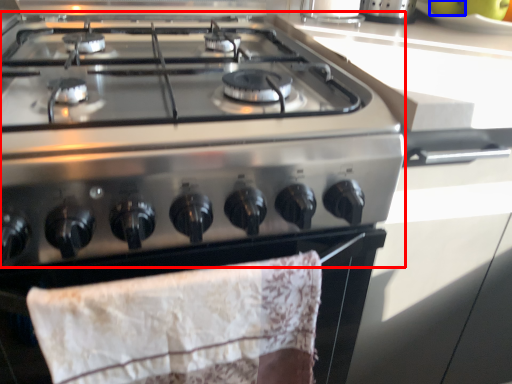
Question: Among these objects, which one is nearest to the camera, gas stove (highlighted by a red box) or fruit (highlighted by a blue box)?

Choices:
 (A) gas stove
 (B) fruit

Answer: (A)